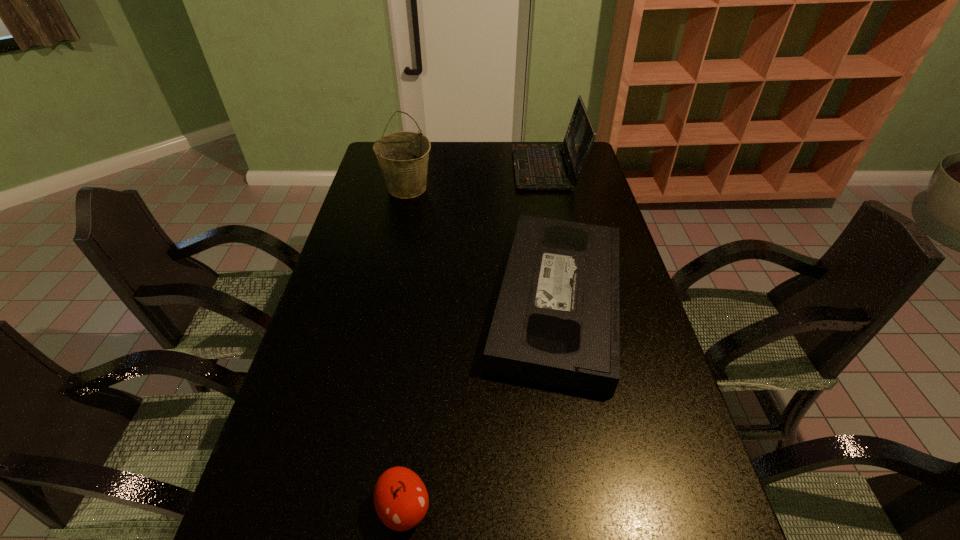
Find the location of a particular element. The height and width of the screenshot is (540, 960). the closest object to the wine bucket is located at coordinates (556, 322).

Locate an element on the screen. This screenshot has height=540, width=960. vacant area that satisfies the following two spatial constraints: 1. on the screen of the second tallest object; 2. on the front side of the second shortest object is located at coordinates (617, 509).